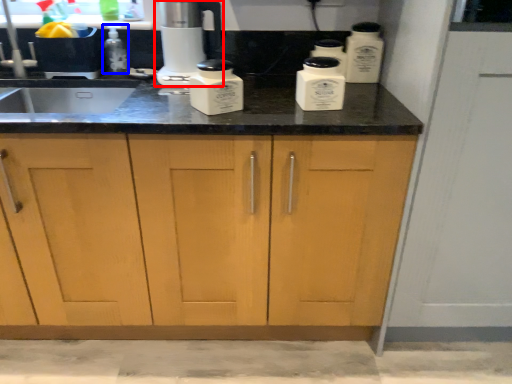
Question: Which of the following is the farthest to the observer, home appliance (highlighted by a red box) or bottle (highlighted by a blue box)?

Choices:
 (A) home appliance
 (B) bottle

Answer: (B)